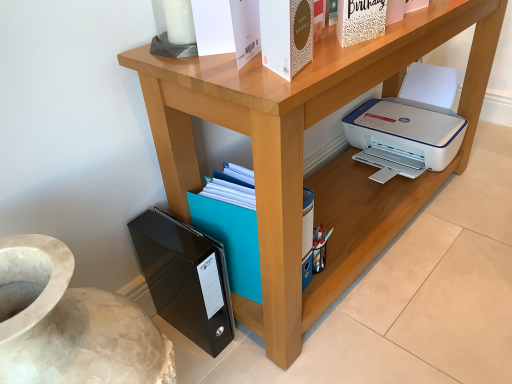
Question: In which direction should I rotate to look at white textured paper at upper center, which is counted as the 3th paperback book, starting from the bottom?

Choices:
 (A) left
 (B) right

Answer: (B)

Question: Can you confirm if wooden printer at lower right is smaller than white textured paper at upper center, the 1th paperback book in the right-to-left sequence?

Choices:
 (A) yes
 (B) no

Answer: (B)

Question: Can you confirm if wooden printer at lower right is positioned to the left of white textured paper at upper center, the second paperback book in the back-to-front sequence?

Choices:
 (A) no
 (B) yes

Answer: (A)

Question: From a real-world perspective, is wooden printer at lower right located beneath white textured paper at upper center, the second paperback book in the back-to-front sequence?

Choices:
 (A) yes
 (B) no

Answer: (A)

Question: Is wooden printer at lower right outside white textured paper at upper center, which ranks as the 3th paperback book in left-to-right order?

Choices:
 (A) no
 (B) yes

Answer: (B)

Question: Does wooden printer at lower right have a larger size compared to white textured paper at upper center, the second paperback book in the back-to-front sequence?

Choices:
 (A) no
 (B) yes

Answer: (B)

Question: Considering the relative positions of wooden printer at lower right and white textured paper at upper center, marked as the 1th paperback book in a top-to-bottom arrangement, in the image provided, is wooden printer at lower right behind white textured paper at upper center, marked as the 1th paperback book in a top-to-bottom arrangement,?

Choices:
 (A) no
 (B) yes

Answer: (A)

Question: Considering the relative positions of wooden printer at lower right and black glossy file folder at lower left, the first paperback book in the bottom-to-top sequence, in the image provided, is wooden printer at lower right behind black glossy file folder at lower left, the first paperback book in the bottom-to-top sequence,?

Choices:
 (A) yes
 (B) no

Answer: (B)

Question: From a real-world perspective, is wooden printer at lower right beneath black glossy file folder at lower left, which appears as the first paperback book when viewed from the left?

Choices:
 (A) yes
 (B) no

Answer: (B)

Question: Considering the relative positions of wooden printer at lower right and black glossy file folder at lower left, the first paperback book in the bottom-to-top sequence, in the image provided, is wooden printer at lower right to the left of black glossy file folder at lower left, the first paperback book in the bottom-to-top sequence, from the viewer's perspective?

Choices:
 (A) no
 (B) yes

Answer: (A)

Question: Is wooden printer at lower right positioned beyond the bounds of black glossy file folder at lower left, which ranks as the 1th paperback book in back-to-front order?

Choices:
 (A) no
 (B) yes

Answer: (B)

Question: From the image's perspective, would you say wooden printer at lower right is positioned over black glossy file folder at lower left, which appears as the first paperback book when viewed from the left?

Choices:
 (A) no
 (B) yes

Answer: (B)

Question: Does wooden printer at lower right have a lesser height compared to black glossy file folder at lower left, which is the third paperback book in front-to-back order?

Choices:
 (A) no
 (B) yes

Answer: (A)

Question: Can you confirm if black glossy file folder at lower left, the third paperback book viewed from the right, is taller than gold textured paper at upper center, which appears as the 2th paperback book when viewed from the left?

Choices:
 (A) yes
 (B) no

Answer: (A)